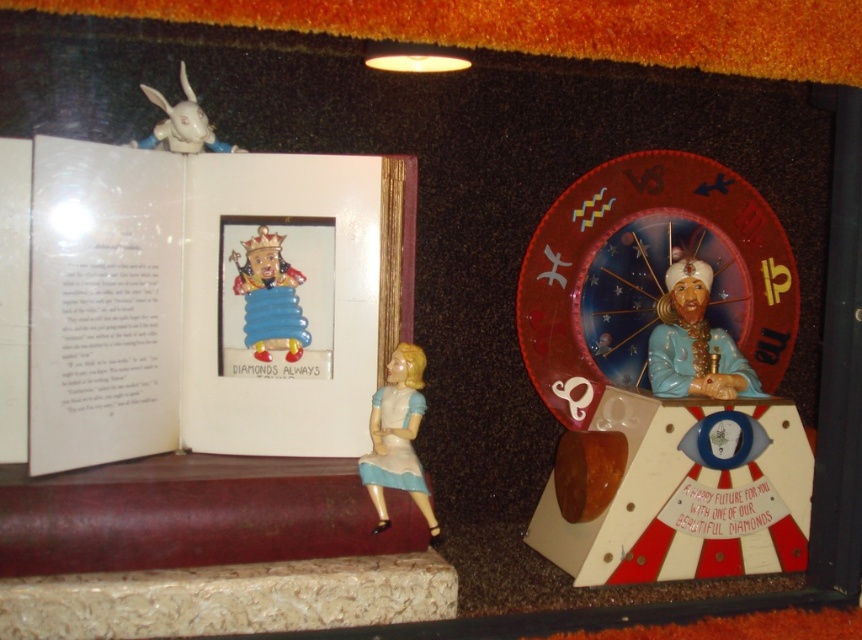
Who is shorter, shiny plastic king at center or white glossy rabbit at upper left?

white glossy rabbit at upper left

Who is more distant from viewer, (258,339) or (130,145)?

The point (258,339) is behind.

Measure the distance between shiny plastic king at center and camera.

They are 3.62 feet apart.

Locate an element on the screen. shiny plastic king at center is located at coordinates (269, 298).

Which is above, matte plastic doll at center or shiny plastic king at center?

Positioned higher is shiny plastic king at center.

Is matte plastic doll at center in front of shiny plastic king at center?

Yes, it is.

Is point (395, 396) behind point (266, 308)?

No, it is in front of (266, 308).

Locate an element on the screen. matte plastic doll at center is located at coordinates (397, 436).

Is the position of matte blue plastic figure at center-right more distant than that of matte plastic doll at center?

Yes, it is.

Who is more distant from viewer, (671, 355) or (420, 476)?

Positioned behind is point (671, 355).

Locate an element on the screen. Image resolution: width=862 pixels, height=640 pixels. matte blue plastic figure at center-right is located at coordinates (694, 342).